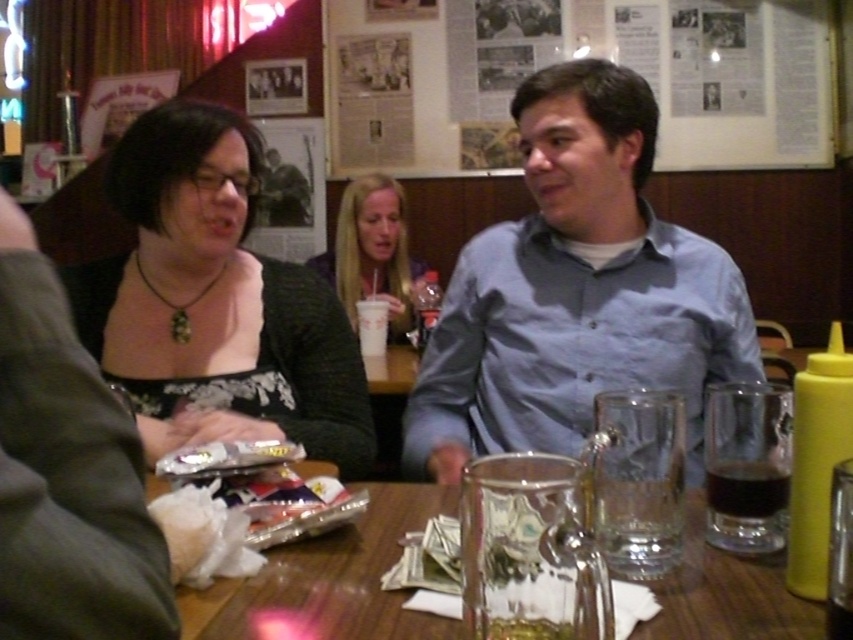
Describe the element at coordinates (215, 301) in the screenshot. The width and height of the screenshot is (853, 640). I see `matte black top at left` at that location.

Is matte black top at left smaller than transparent glass at center?

Actually, matte black top at left might be larger than transparent glass at center.

Where is `matte black top at left`? matte black top at left is located at coordinates (215, 301).

Identify the location of matte black top at left. The image size is (853, 640). (215, 301).

Can you confirm if matte black top at left is positioned above blonde hair at center?

Actually, matte black top at left is below blonde hair at center.

Is matte black top at left to the left of blonde hair at center from the viewer's perspective?

Yes, matte black top at left is to the left of blonde hair at center.

Is point (206, 396) more distant than point (393, 337)?

No, it is in front of (393, 337).

Locate an element on the screen. matte black top at left is located at coordinates (215, 301).

Which is more to the right, matte black top at left or shiny foil snack at center?

shiny foil snack at center

In order to click on matte black top at left in this screenshot , I will do `click(215, 301)`.